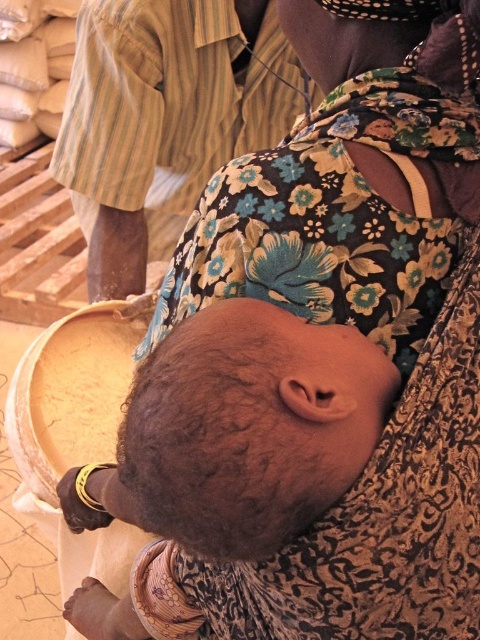
Looking at this image, you are a photographer setting up a shoot in this indoor scene. You need to ensure that both the dark brown hair at center and the striped cotton shirt at upper left are visible in the frame. Based on their heights, which object should you adjust the camera angle to focus on first?

The dark brown hair at center is shorter than the striped cotton shirt at upper left. To ensure both are visible, focus on the striped cotton shirt at upper left first since it is taller and adjust the angle to include the shorter dark brown hair at center.

You are a photographer trying to capture a candid shot of the dark brown hair at center and the striped cotton shirt at upper left. Given that your camera has a maximum focus range of 36 inches, will both subjects be in focus?

The dark brown hair at center is 36.33 inches from the striped cotton shirt at upper left. Since the distance between them exceeds the camera focus range of 36 inches, both subjects will not be in focus simultaneously.